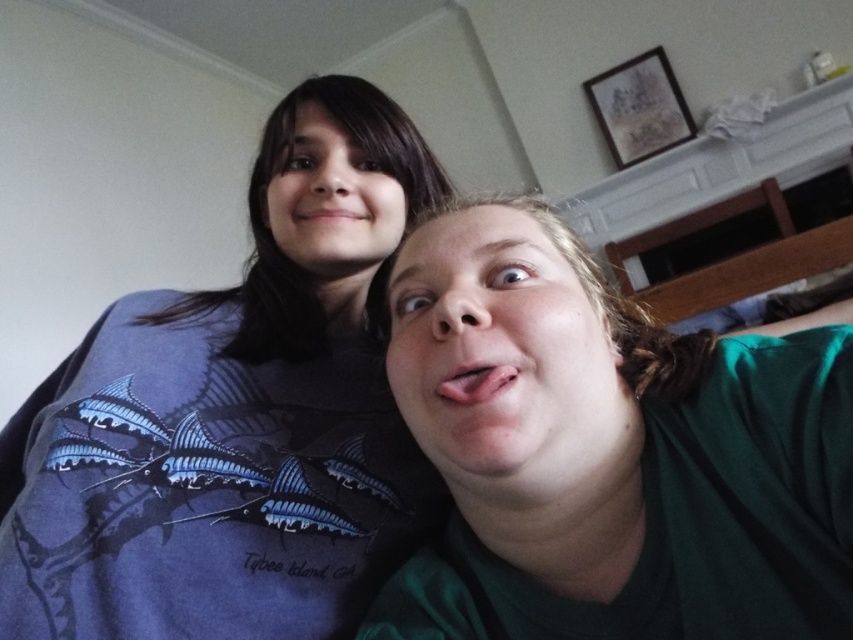
Does blue matte shirt at upper left appear on the right side of green matte shirt at lower right?

In fact, blue matte shirt at upper left is to the left of green matte shirt at lower right.

Between blue matte shirt at upper left and green matte shirt at lower right, which one appears on the left side from the viewer's perspective?

From the viewer's perspective, blue matte shirt at upper left appears more on the left side.

Find the location of a particular element. The width and height of the screenshot is (853, 640). blue matte shirt at upper left is located at coordinates (234, 417).